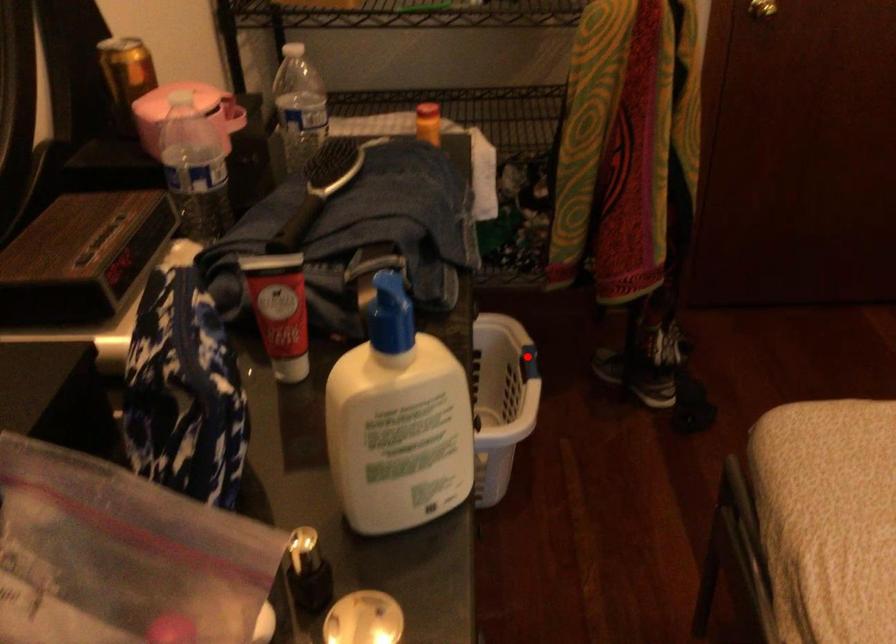
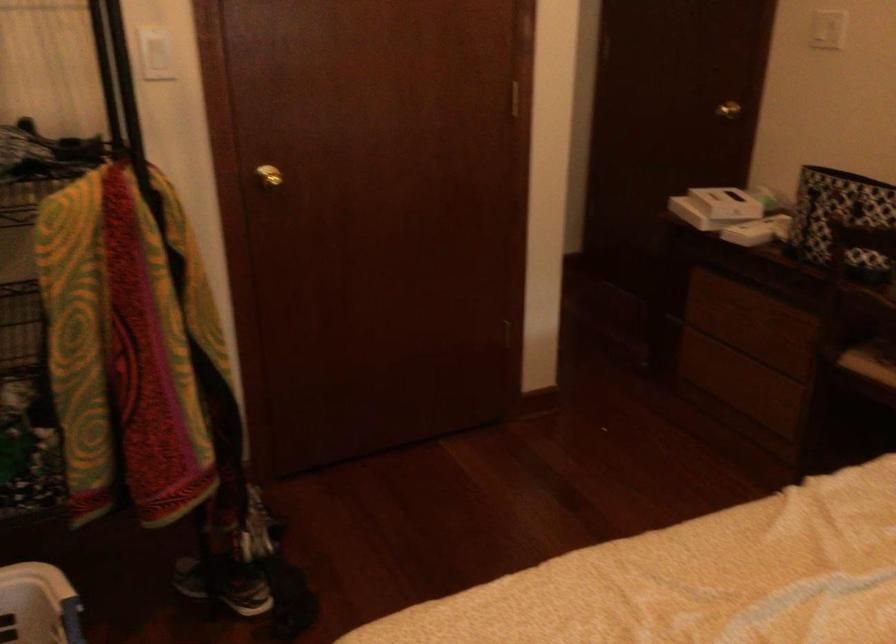
Question: I am providing you with two images of the same scene from different viewpoints. In image1, a red point is highlighted. Considering the same 3D point in image2, which of the following is correct?

Choices:
 (A) It is closer
 (B) It is farther

Answer: (A)